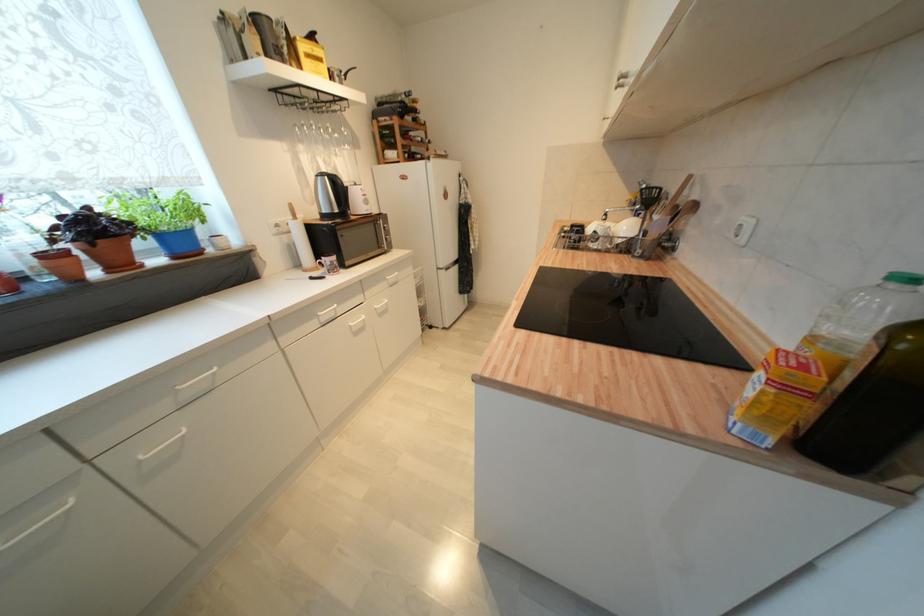
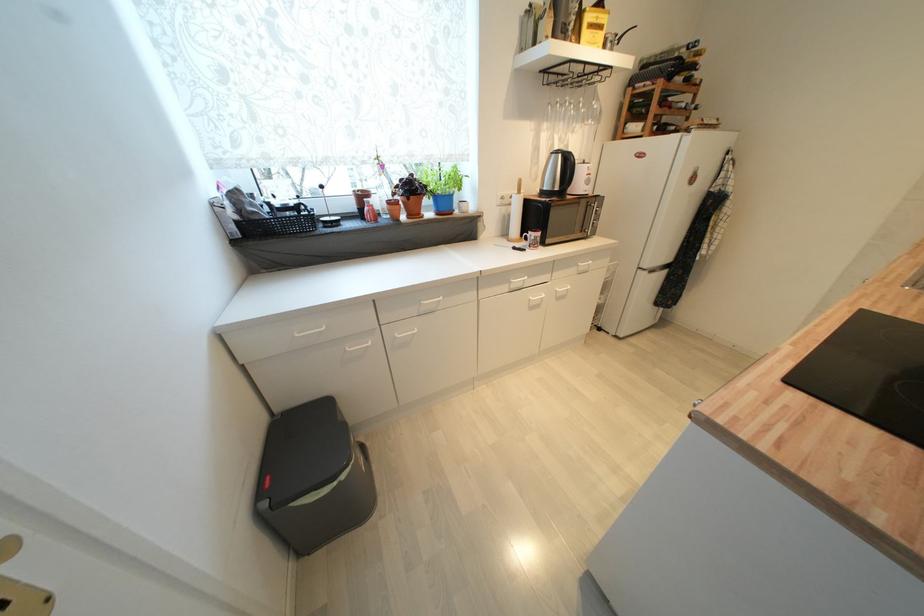
Where in the second image is the point corresponding to [395,284] from the first image?

(585, 270)